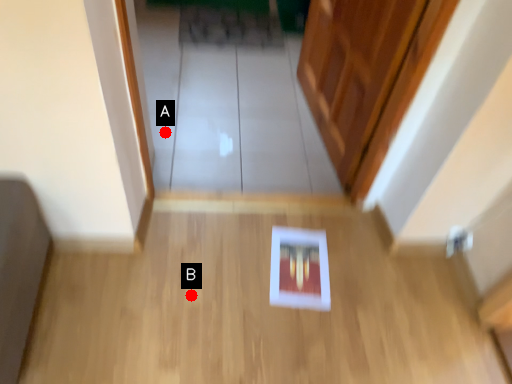
Question: Two points are circled on the image, labeled by A and B beside each circle. Which point is farther to the camera?

Choices:
 (A) A is further
 (B) B is further

Answer: (A)